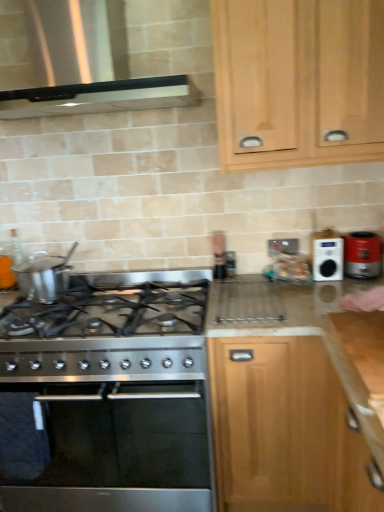
Question: From the image's perspective, is stainless steel oven at lower left located above matte red toaster at right?

Choices:
 (A) no
 (B) yes

Answer: (A)

Question: Is there a large distance between stainless steel oven at lower left and matte red toaster at right?

Choices:
 (A) no
 (B) yes

Answer: (B)

Question: Considering the relative sizes of stainless steel oven at lower left and matte red toaster at right in the image provided, is stainless steel oven at lower left wider than matte red toaster at right?

Choices:
 (A) no
 (B) yes

Answer: (B)

Question: Could you tell me if stainless steel oven at lower left is turned towards matte red toaster at right?

Choices:
 (A) yes
 (B) no

Answer: (B)

Question: Considering the relative sizes of stainless steel oven at lower left and matte red toaster at right in the image provided, is stainless steel oven at lower left taller than matte red toaster at right?

Choices:
 (A) yes
 (B) no

Answer: (A)

Question: Is point (329, 336) positioned closer to the camera than point (322, 257)?

Choices:
 (A) farther
 (B) closer

Answer: (B)

Question: From the image's perspective, is light wood cabinet at center, positioned as the second cabinetry in top-to-bottom order, located above or below white plastic radio at upper right?

Choices:
 (A) below
 (B) above

Answer: (A)

Question: Is light wood cabinet at center, positioned as the second cabinetry in top-to-bottom order, inside the boundaries of white plastic radio at upper right, or outside?

Choices:
 (A) inside
 (B) outside

Answer: (B)

Question: From a real-world perspective, is light wood cabinet at center, placed as the first cabinetry when sorted from bottom to top, positioned above or below white plastic radio at upper right?

Choices:
 (A) above
 (B) below

Answer: (B)

Question: Is stainless steel oven at lower left inside or outside of matte red toaster at right?

Choices:
 (A) inside
 (B) outside

Answer: (B)

Question: Considering the positions of stainless steel oven at lower left and matte red toaster at right in the image, is stainless steel oven at lower left taller or shorter than matte red toaster at right?

Choices:
 (A) tall
 (B) short

Answer: (A)

Question: Considering the positions of stainless steel oven at lower left and matte red toaster at right in the image, is stainless steel oven at lower left bigger or smaller than matte red toaster at right?

Choices:
 (A) small
 (B) big

Answer: (B)

Question: From a real-world perspective, is stainless steel oven at lower left above or below matte red toaster at right?

Choices:
 (A) below
 (B) above

Answer: (A)

Question: From the image's perspective, is matte red toaster at right above or below light wood cabinet at upper right, the 2th cabinetry ordered from the bottom?

Choices:
 (A) above
 (B) below

Answer: (B)

Question: Looking at their shapes, would you say matte red toaster at right is wider or thinner than light wood cabinet at upper right, positioned as the first cabinetry in top-to-bottom order?

Choices:
 (A) thin
 (B) wide

Answer: (A)